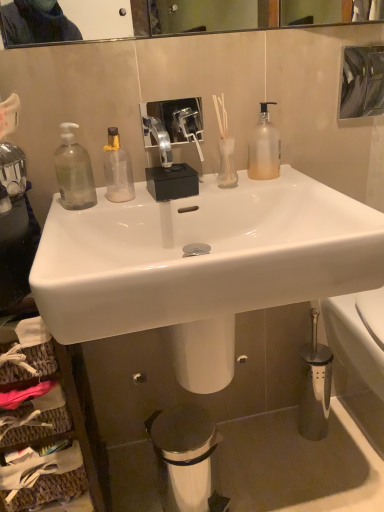
What is the approximate height of clear glass vase at center?

It is 7.80 inches.

You are a GUI agent. You are given a task and a screenshot of the screen. Output one action in this format:
    pyautogui.click(x=<x>, y=<y>)
    Task: Click on the white glossy sink at center
    The height and width of the screenshot is (512, 384).
    Given the screenshot: What is the action you would take?
    pyautogui.click(x=202, y=264)

Image resolution: width=384 pixels, height=512 pixels. What do you see at coordinates (202, 264) in the screenshot?
I see `white glossy sink at center` at bounding box center [202, 264].

This screenshot has height=512, width=384. What do you see at coordinates (44, 426) in the screenshot?
I see `woven wood cabinet at lower left` at bounding box center [44, 426].

This screenshot has width=384, height=512. I want to click on transparent plastic bottle at left, which ranks as the first bottle in left-to-right order, so click(74, 170).

Find the location of a particular element. The height and width of the screenshot is (512, 384). clear glass vase at center is located at coordinates click(x=225, y=147).

In terms of height, does frosted glass pump bottle at upper right, which is counted as the 3th bottle, starting from the left, look taller or shorter compared to clear glass bottle at center, the second bottle positioned from the left?

Clearly, frosted glass pump bottle at upper right, which is counted as the 3th bottle, starting from the left, is taller compared to clear glass bottle at center, the second bottle positioned from the left.

What's the angular difference between frosted glass pump bottle at upper right, which is counted as the 3th bottle, starting from the left, and clear glass bottle at center, which is the 2th bottle from right to left,'s facing directions?

The angle between the facing direction of frosted glass pump bottle at upper right, which is counted as the 3th bottle, starting from the left, and the facing direction of clear glass bottle at center, which is the 2th bottle from right to left, is 0.00204 degrees.

Between point (250, 142) and point (114, 186), which one is positioned in front?

The point (114, 186) is more forward.

Does frosted glass pump bottle at upper right, which is counted as the 3th bottle, starting from the left, have a smaller size compared to clear glass bottle at center, which is the 2th bottle from right to left?

Incorrect, frosted glass pump bottle at upper right, which is counted as the 3th bottle, starting from the left, is not smaller in size than clear glass bottle at center, which is the 2th bottle from right to left.

Looking at this image, is frosted glass pump bottle at upper right, the first bottle positioned from the right, oriented towards transparent plastic bottle at left, which ranks as the first bottle in left-to-right order?

No, frosted glass pump bottle at upper right, the first bottle positioned from the right, is not turned towards transparent plastic bottle at left, which ranks as the first bottle in left-to-right order.

Considering the positions of objects frosted glass pump bottle at upper right, which is counted as the 3th bottle, starting from the left, and transparent plastic bottle at left, which is the 3th bottle in right-to-left order, in the image provided, who is more to the left, frosted glass pump bottle at upper right, which is counted as the 3th bottle, starting from the left, or transparent plastic bottle at left, which is the 3th bottle in right-to-left order,?

transparent plastic bottle at left, which is the 3th bottle in right-to-left order.

Is the surface of frosted glass pump bottle at upper right, which is counted as the 3th bottle, starting from the left, in direct contact with transparent plastic bottle at left, which is the 3th bottle in right-to-left order?

No, frosted glass pump bottle at upper right, which is counted as the 3th bottle, starting from the left, is not beside transparent plastic bottle at left, which is the 3th bottle in right-to-left order.

From the image's perspective, who appears lower, frosted glass pump bottle at upper right, which is counted as the 3th bottle, starting from the left, or transparent plastic bottle at left, which ranks as the first bottle in left-to-right order?

transparent plastic bottle at left, which ranks as the first bottle in left-to-right order.

Looking at this image, is white glossy sink at center surrounded by woven wood cabinet at lower left?

Actually, white glossy sink at center is outside woven wood cabinet at lower left.

Is woven wood cabinet at lower left wider or thinner than white glossy sink at center?

In the image, woven wood cabinet at lower left appears to be more narrow than white glossy sink at center.

Which is in front, point (17, 340) or point (252, 301)?

The point (252, 301) is more forward.

Image resolution: width=384 pixels, height=512 pixels. Identify the location of sink above the woven wood cabinet at lower left (from a real-world perspective). (202, 264).

Is clear glass bottle at center, which is the 2th bottle from right to left, next to frosted glass pump bottle at upper right, the first bottle positioned from the right?

No, clear glass bottle at center, which is the 2th bottle from right to left, is not beside frosted glass pump bottle at upper right, the first bottle positioned from the right.

Find the location of a particular element. the 1st bottle counting from the left of the frosted glass pump bottle at upper right, which is counted as the 3th bottle, starting from the left is located at coordinates click(117, 169).

Is frosted glass pump bottle at upper right, which is counted as the 3th bottle, starting from the left, inside clear glass bottle at center, which is the 2th bottle from right to left?

No, frosted glass pump bottle at upper right, which is counted as the 3th bottle, starting from the left, is not surrounded by clear glass bottle at center, which is the 2th bottle from right to left.

Could you measure the distance between clear glass bottle at center, the second bottle positioned from the left, and frosted glass pump bottle at upper right, which is counted as the 3th bottle, starting from the left?

clear glass bottle at center, the second bottle positioned from the left, is 12.69 inches away from frosted glass pump bottle at upper right, which is counted as the 3th bottle, starting from the left.

Is clear glass bottle at center, which is the 2th bottle from right to left, completely or partially outside of translucent glass vase at center?

clear glass bottle at center, which is the 2th bottle from right to left, lies outside translucent glass vase at center's area.

Looking at their sizes, would you say clear glass bottle at center, the second bottle positioned from the left, is wider or thinner than translucent glass vase at center?

In the image, clear glass bottle at center, the second bottle positioned from the left, appears to be wider than translucent glass vase at center.

Considering the points (109, 196) and (224, 157), which point is behind, point (109, 196) or point (224, 157)?

Point (224, 157)

Is clear glass bottle at center, the second bottle positioned from the left, next to translucent glass vase at center and touching it?

No, clear glass bottle at center, the second bottle positioned from the left, is not with translucent glass vase at center.

Which object is positioned more to the left, metallic reflective mirror at upper right or clear glass bottle at center, which is the 2th bottle from right to left?

clear glass bottle at center, which is the 2th bottle from right to left, is more to the left.

Could you tell me if metallic reflective mirror at upper right is facing clear glass bottle at center, which is the 2th bottle from right to left?

No.

Would you consider metallic reflective mirror at upper right to be distant from clear glass bottle at center, which is the 2th bottle from right to left?

That's right, there is a large distance between metallic reflective mirror at upper right and clear glass bottle at center, which is the 2th bottle from right to left.

From a real-world perspective, who is located higher, clear glass vase at center or white glossy toilet at lower right?

clear glass vase at center, from a real-world perspective.

How different are the orientations of clear glass vase at center and white glossy toilet at lower right in degrees?

5.92 degrees.

Is clear glass vase at center far away from white glossy toilet at lower right?

No, clear glass vase at center is not far away from white glossy toilet at lower right.

From a real-world perspective, starting from the frosted glass pump bottle at upper right, the first bottle positioned from the right, which bottle is the 2nd one below it? Please provide its 2D coordinates.

[(117, 169)]

There is a frosted glass pump bottle at upper right, the first bottle positioned from the right. At what (x,y) coordinates should I click in order to perform the action: click on the 2nd bottle below it (from the image's perspective). Please return your answer as a coordinate pair (x, y). The height and width of the screenshot is (512, 384). Looking at the image, I should click on (74, 170).

Considering their positions, is woven wood cabinet at lower left positioned further to transparent plastic bottle at left, which ranks as the first bottle in left-to-right order, than translucent glass vase at center?

The object further to transparent plastic bottle at left, which ranks as the first bottle in left-to-right order, is woven wood cabinet at lower left.

Which object lies further to the anchor point metallic trash can at lower center, metallic reflective mirror at upper right or woven wood cabinet at lower left?

Among the two, metallic reflective mirror at upper right is located further to metallic trash can at lower center.

Based on their spatial positions, is woven wood cabinet at lower left or white glossy toilet at lower right closer to frosted glass pump bottle at upper right, which is counted as the 3th bottle, starting from the left?

Among the two, white glossy toilet at lower right is located nearer to frosted glass pump bottle at upper right, which is counted as the 3th bottle, starting from the left.

Based on their spatial positions, is metallic reflective mirror at upper right or clear glass bottle at center, which is the 2th bottle from right to left, closer to translucent glass vase at center?

clear glass bottle at center, which is the 2th bottle from right to left, lies closer to translucent glass vase at center than the other object.

When comparing their distances from frosted glass pump bottle at upper right, which is counted as the 3th bottle, starting from the left, does translucent glass vase at center or transparent plastic bottle at left, which is the 3th bottle in right-to-left order, seem closer?

Among the two, translucent glass vase at center is located nearer to frosted glass pump bottle at upper right, which is counted as the 3th bottle, starting from the left.

From the image, which object appears to be nearer to transparent plastic bottle at left, which is the 3th bottle in right-to-left order, translucent glass vase at center or white glossy toilet at lower right?

translucent glass vase at center is closer to transparent plastic bottle at left, which is the 3th bottle in right-to-left order.

From the image, which object appears to be farther from white glossy sink at center, frosted glass pump bottle at upper right, which is counted as the 3th bottle, starting from the left, or clear glass bottle at center, which is the 2th bottle from right to left?

frosted glass pump bottle at upper right, which is counted as the 3th bottle, starting from the left, is further to white glossy sink at center.

Based on their spatial positions, is white glossy toilet at lower right or transparent plastic bottle at left, which is the 3th bottle in right-to-left order, further from frosted glass pump bottle at upper right, which is counted as the 3th bottle, starting from the left?

white glossy toilet at lower right is further to frosted glass pump bottle at upper right, which is counted as the 3th bottle, starting from the left.

The height and width of the screenshot is (512, 384). In order to click on toilet between clear glass vase at center and metallic trash can at lower center in the up-down direction in this screenshot , I will do `click(353, 341)`.

What are the coordinates of `toiletry situated between transparent plastic bottle at left, which ranks as the first bottle in left-to-right order, and translucent glass vase at center from left to right` in the screenshot? It's located at (225, 147).

The image size is (384, 512). Find the location of `cabinetry between metallic reflective mirror at upper right and metallic trash can at lower center in the vertical direction`. cabinetry between metallic reflective mirror at upper right and metallic trash can at lower center in the vertical direction is located at coordinates click(x=44, y=426).

I want to click on toiletry located between clear glass bottle at center, which is the 2th bottle from right to left, and translucent glass vase at center in the left-right direction, so click(x=225, y=147).